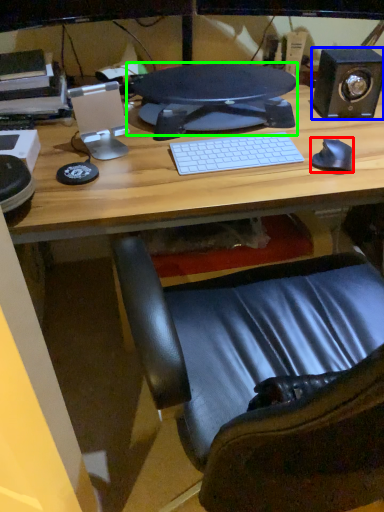
Question: Estimate the real-world distances between objects in this image. Which object is closer to mouse (highlighted by a red box), speaker (highlighted by a blue box) or computer monitor (highlighted by a green box)?

Choices:
 (A) speaker
 (B) computer monitor

Answer: (A)